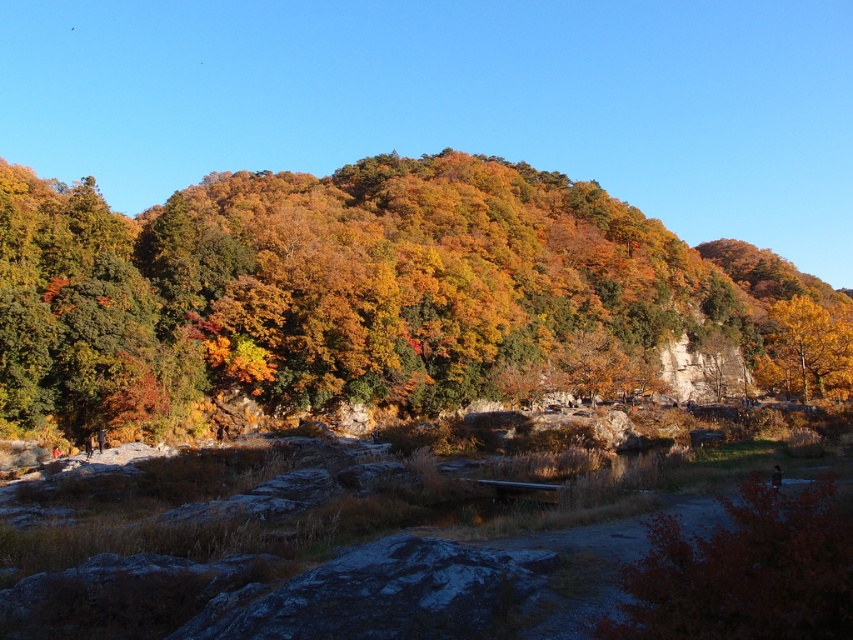
Question: Is autumn leaves at center wider than golden yellow leaves at upper right?

Choices:
 (A) yes
 (B) no

Answer: (A)

Question: Which object appears closest to the camera in this image?

Choices:
 (A) autumn leaves at center
 (B) shiny red bush at lower right

Answer: (B)

Question: Estimate the real-world distances between objects in this image. Which object is farther from the golden yellow leaves at upper right?

Choices:
 (A) shiny red bush at lower right
 (B) autumn leaves at center

Answer: (A)

Question: Which of the following is the farthest from the observer?

Choices:
 (A) golden yellow leaves at upper right
 (B) autumn leaves at center

Answer: (A)

Question: Is autumn leaves at center to the left of shiny red bush at lower right from the viewer's perspective?

Choices:
 (A) no
 (B) yes

Answer: (B)

Question: Can you confirm if autumn leaves at center is positioned below shiny red bush at lower right?

Choices:
 (A) yes
 (B) no

Answer: (B)